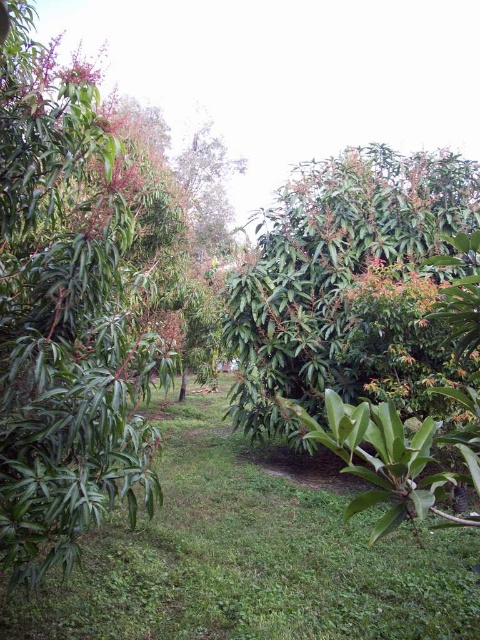
You are a gardener who wants to plant a new tree that requires a space taller than 3 meters. Looking at the green glossy leafy tree at left and the green glossy tree at center, which one would you consider for the new tree based on their heights?

The green glossy tree at center is taller than the green glossy leafy tree at left, so you should choose the green glossy tree at center for planting the new tree that requires a space taller than 3 meters.

Looking at this image, you are a gardener who needs to water the green grass at center and the green glossy tree at center. Which one should you water first if you want to start from the lowest point in the garden?

The green grass at center is located below the green glossy tree at center, so you should water the green grass at center first as it is lower in elevation.